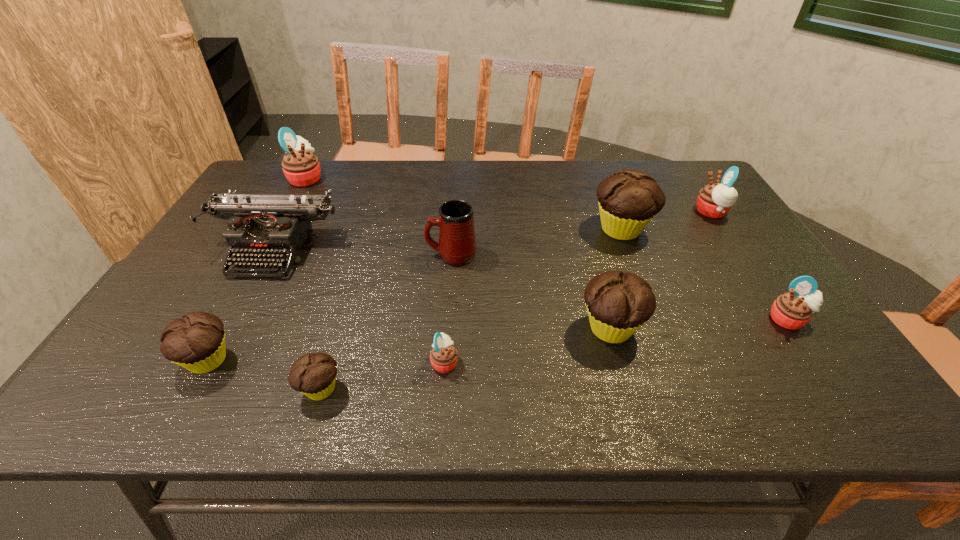
Locate an element on the screen. vacant space located on the side of the red mug with the handle is located at coordinates (342, 254).

Identify the location of vacant space located on the keyboard of the typewriter. This screenshot has width=960, height=540. (194, 406).

I want to click on vacant space located 0.320m on the left of the third smallest chocolate muffin, so click(438, 328).

You are a GUI agent. You are given a task and a screenshot of the screen. Output one action in this format:
    pyautogui.click(x=<x>, y=<y>)
    Task: Click on the vacant point located 0.060m on the front-facing side of the second smallest pink muffin
    This screenshot has height=540, width=960.
    Given the screenshot: What is the action you would take?
    pyautogui.click(x=812, y=354)

Locate an element on the screen. vacant space situated on the right of the leftmost chocolate muffin is located at coordinates (358, 360).

I want to click on free location located 0.300m on the front-facing side of the smallest pink muffin, so click(599, 362).

The width and height of the screenshot is (960, 540). I want to click on vacant space located 0.070m on the left of the third muffin from left to right, so click(264, 389).

This screenshot has height=540, width=960. I want to click on object located at the far edge, so click(x=301, y=168).

Where is `typewriter that is at the left edge`? The width and height of the screenshot is (960, 540). typewriter that is at the left edge is located at coordinates (x=260, y=226).

At what (x,y) coordinates should I click in order to perform the action: click on object present at the far left corner. Please return your answer as a coordinate pair (x, y). Looking at the image, I should click on (301, 168).